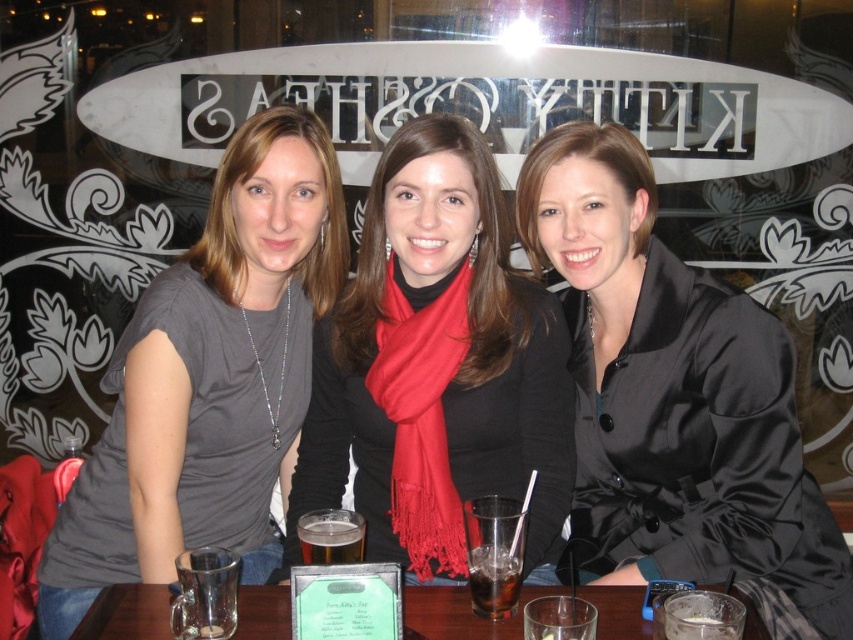
You are a barista at Kitty Coffee and need to place a new order for a customer. The order includes both the satin black coat at center and the translucent glass beer at center. According to the image, which item should you place to the right side of the other?

The satin black coat at center is to the right of the translucent glass beer at center, so you should place the satin black coat at center to the right of the translucent glass beer at center.

Looking at this image, you are a barista at Kitty Coffee. A customer asks if they can take their satin black coat at center and translucent glass beer at center to the outdoor seating area. The outdoor tables only allow items smaller than the coat. Can they take both items?

The satin black coat at center is bigger than the translucent glass beer at center, so the coat cannot be taken to the outdoor seating area. The translucent glass beer at center is smaller and can be taken.